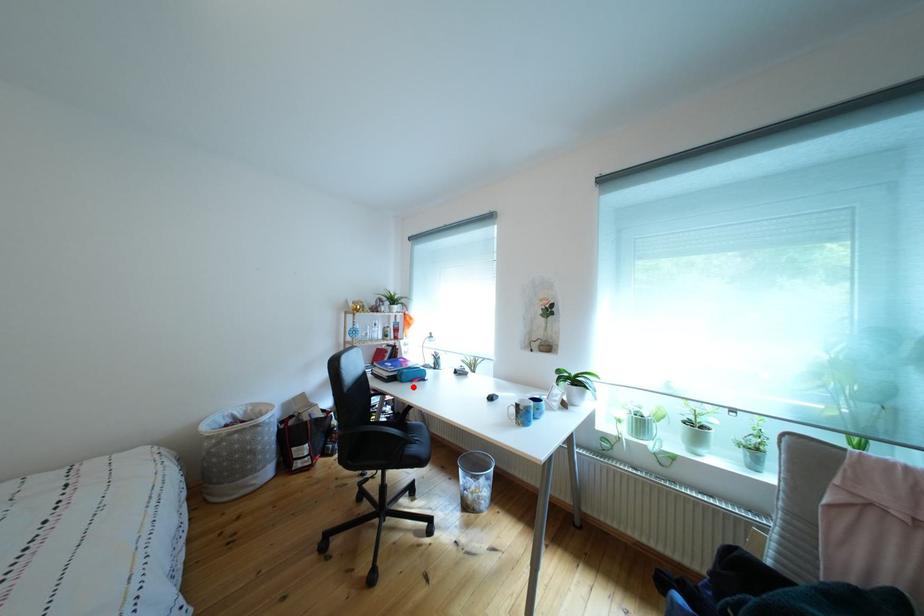
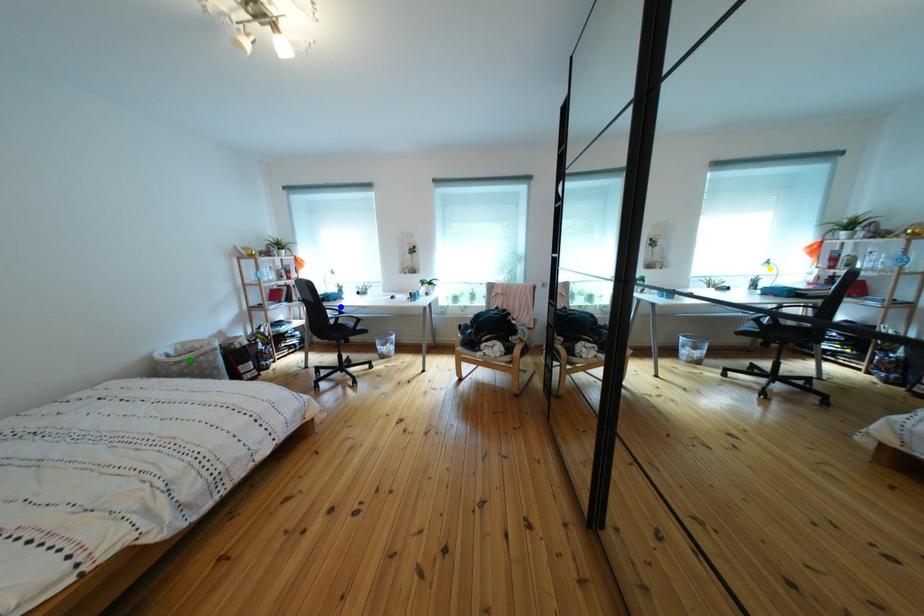
Question: I am providing you with two images of the same scene from different viewpoints. A red point is marked on the first image. You are given multiple points on the second image. Which mark in image 2 goes with the point in image 1?

Choices:
 (A) yellow point
 (B) blue point
 (C) green point

Answer: (B)